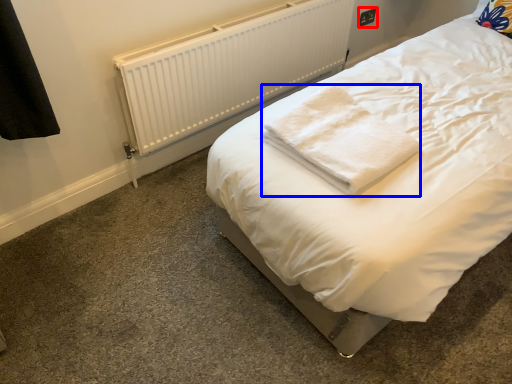
Question: Which object is closer to the camera taking this photo, electric outlet (highlighted by a red box) or cloth (highlighted by a blue box)?

Choices:
 (A) electric outlet
 (B) cloth

Answer: (B)